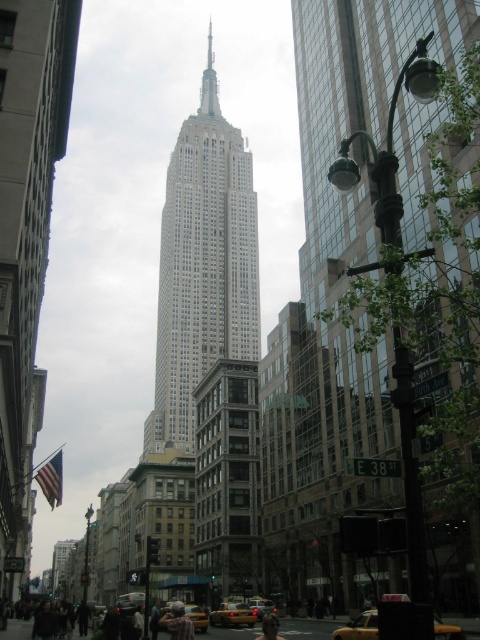
Based on the photo, between yellow matte taxi at center and yellow metallic taxi cab at center, which one is positioned lower?

yellow metallic taxi cab at center is below.

Is yellow matte taxi at center thinner than yellow metallic taxi cab at center?

No.

The width and height of the screenshot is (480, 640). What do you see at coordinates (360, 627) in the screenshot?
I see `yellow matte taxi at center` at bounding box center [360, 627].

Where is `yellow matte taxi at center`? The height and width of the screenshot is (640, 480). yellow matte taxi at center is located at coordinates (360, 627).

Is yellow rubber taxi at center positioned at the back of yellow matte taxi at lower center?

Yes, yellow rubber taxi at center is behind yellow matte taxi at lower center.

Does yellow rubber taxi at center appear on the right side of yellow matte taxi at lower center?

Correct, you'll find yellow rubber taxi at center to the right of yellow matte taxi at lower center.

Is point (213, 620) behind point (193, 625)?

That is True.

The height and width of the screenshot is (640, 480). What are the coordinates of `yellow rubber taxi at center` in the screenshot? It's located at (232, 614).

Is white smooth skyscraper at center to the left of yellow matte taxi at lower center from the viewer's perspective?

Indeed, white smooth skyscraper at center is positioned on the left side of yellow matte taxi at lower center.

Can you confirm if white smooth skyscraper at center is taller than yellow matte taxi at lower center?

Yes.

Describe the element at coordinates (203, 266) in the screenshot. The image size is (480, 640). I see `white smooth skyscraper at center` at that location.

Where is `white smooth skyscraper at center`? This screenshot has width=480, height=640. white smooth skyscraper at center is located at coordinates (203, 266).